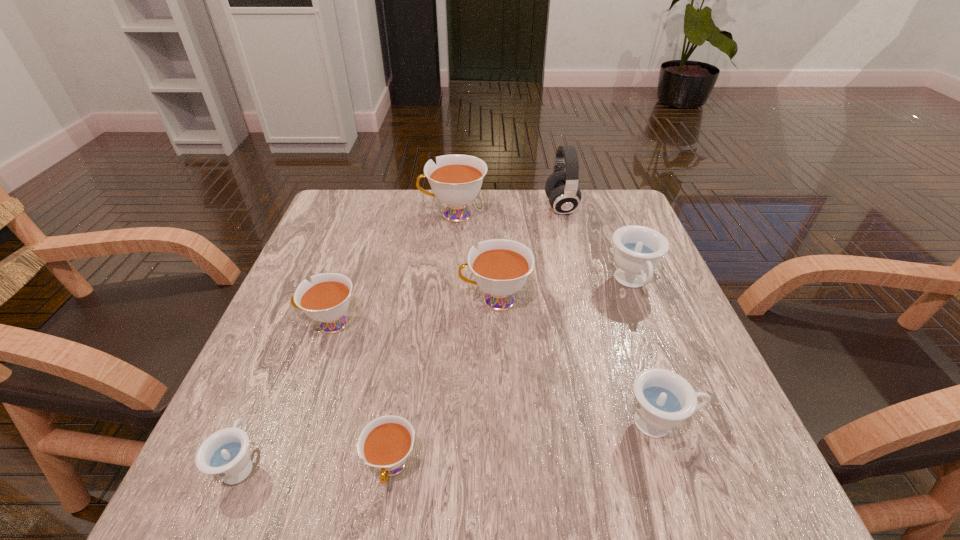
The image size is (960, 540). What are the coordinates of `free space located 0.370m on the side of the smallest blue teacup with the handle` in the screenshot? It's located at (318, 280).

This screenshot has height=540, width=960. Identify the location of vacant space situated on the side of the smallest blue teacup with the handle. (296, 332).

Where is `headset at the far edge`? Image resolution: width=960 pixels, height=540 pixels. headset at the far edge is located at coordinates (561, 187).

The height and width of the screenshot is (540, 960). Find the location of `teacup present at the far edge`. teacup present at the far edge is located at coordinates (456, 180).

Image resolution: width=960 pixels, height=540 pixels. I want to click on headset situated at the right edge, so click(561, 187).

The height and width of the screenshot is (540, 960). Find the location of `object at the near left corner`. object at the near left corner is located at coordinates (225, 455).

Image resolution: width=960 pixels, height=540 pixels. Identify the location of object that is at the far right corner. (561, 187).

The width and height of the screenshot is (960, 540). Identify the location of object present at the near right corner. (663, 399).

I want to click on vacant area at the far edge of the desktop, so click(x=420, y=224).

Identify the location of vacant space at the left edge of the desktop. (296, 430).